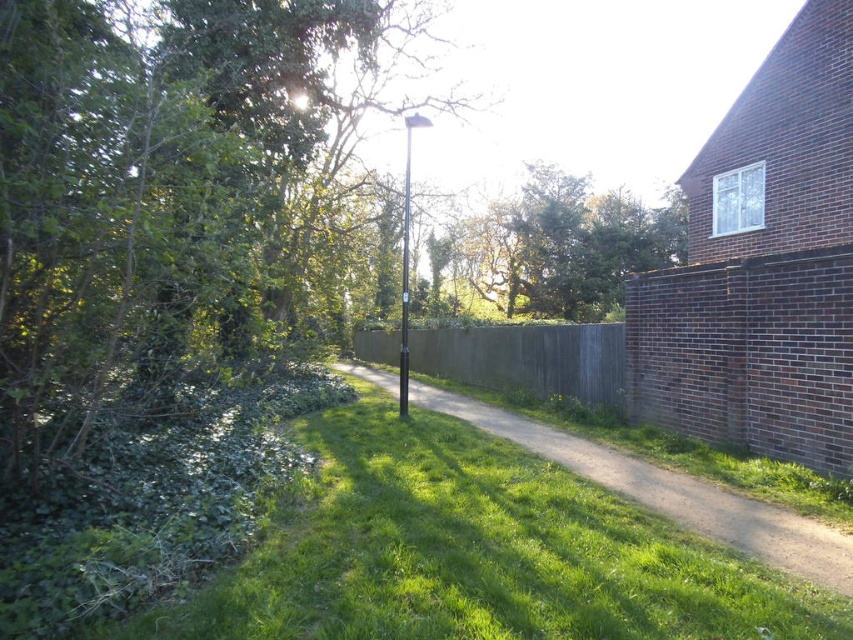
You are standing at the point marked by coordinates [163,193] in the image. Based on the scene description, what object are you likely standing on?

The point marked by coordinates [163,193] is on the green leafy tree at upper left, so you are likely standing on the green leafy tree at upper left.

You are standing at the starting point of the pathway and want to locate the green leafy tree at upper left. According to the coordinates provided, where should you look relative to your current position?

The green leafy tree at upper left is located at coordinates point [163,193], which means it is positioned to the upper left relative to your current position on the pathway.